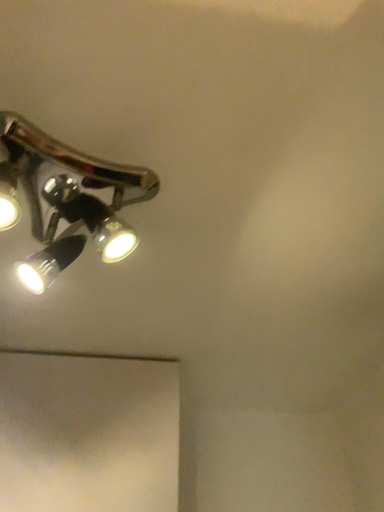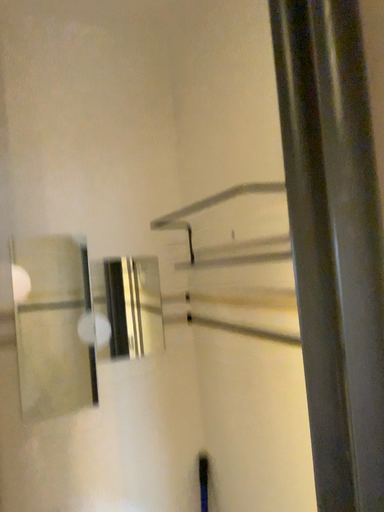
Question: How did the camera likely rotate when shooting the video?

Choices:
 (A) rotated right
 (B) rotated left

Answer: (A)